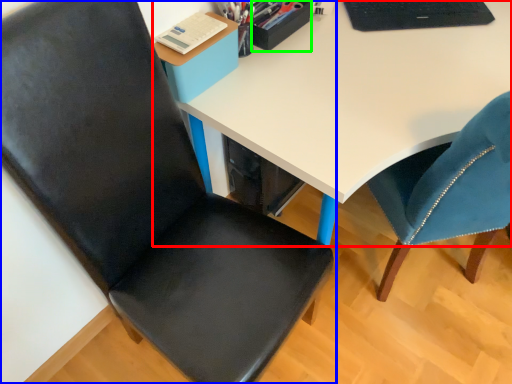
Question: Considering the real-world distances, which object is farthest from desk (highlighted by a red box)? chair (highlighted by a blue box) or stationery (highlighted by a green box)?

Choices:
 (A) chair
 (B) stationery

Answer: (A)